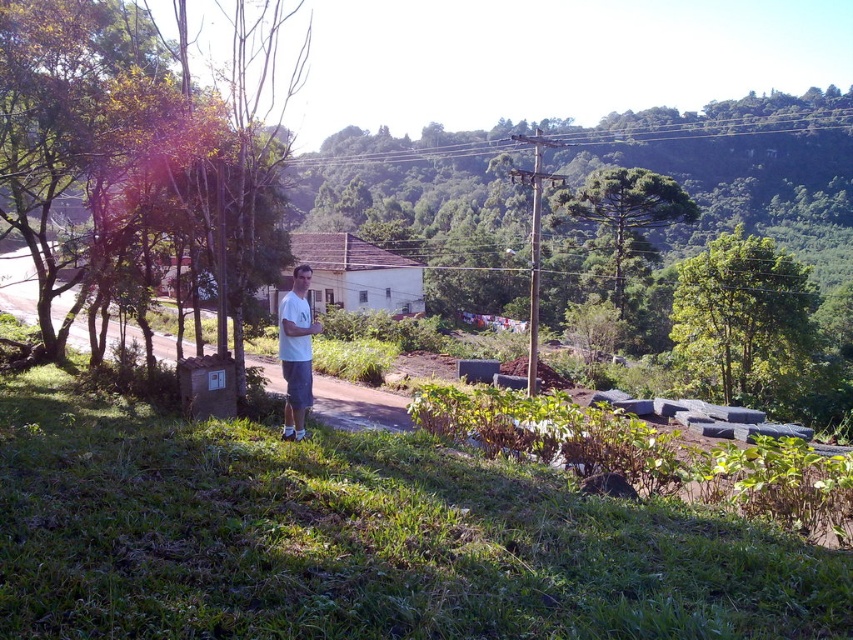
Question: Which point is closer to the camera?

Choices:
 (A) (726, 244)
 (B) (300, 298)
 (C) (15, 56)

Answer: (B)

Question: Is green leafy tree at upper right wider than green needle-like tree at center-right?

Choices:
 (A) no
 (B) yes

Answer: (A)

Question: Does green leafy tree at left appear on the right side of green needle-like tree at center-right?

Choices:
 (A) yes
 (B) no

Answer: (B)

Question: Can you confirm if green leafy tree at left is bigger than green leafy tree at upper right?

Choices:
 (A) yes
 (B) no

Answer: (A)

Question: Which object is positioned farthest from the green needle-like tree at center-right?

Choices:
 (A) white matte shirt at center
 (B) green leafy tree at left

Answer: (A)

Question: Which point is farther to the camera?

Choices:
 (A) white matte shirt at center
 (B) green needle-like tree at center-right
 (C) green leafy tree at left

Answer: (B)